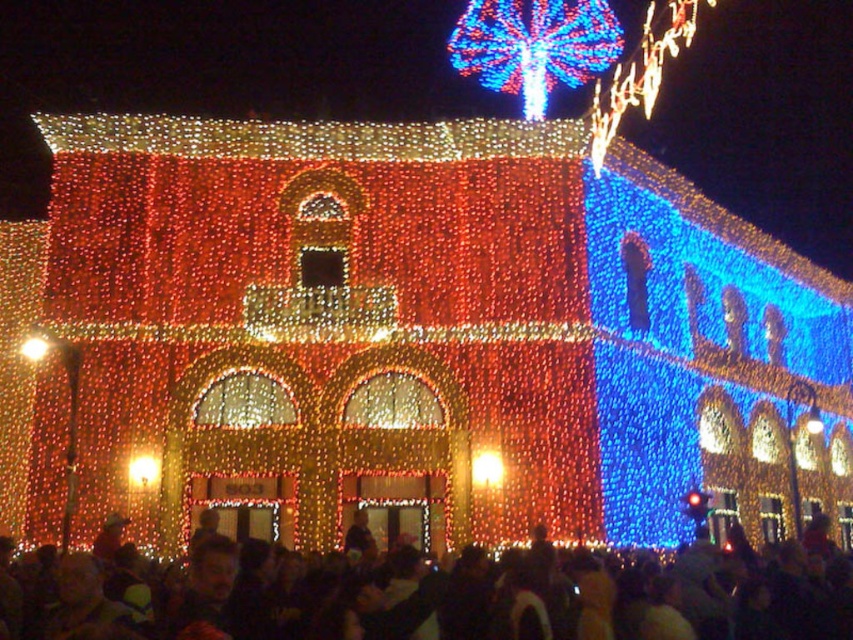
Locate an element on the screen. The width and height of the screenshot is (853, 640). matte gold light at center is located at coordinates [x=143, y=470].

Identify the location of matte gold light at center. (143, 470).

Is point (122, 561) more distant than point (134, 481)?

No, (122, 561) is in front of (134, 481).

Who is shorter, black matte crowd at lower center or matte gold light at center?

With less height is matte gold light at center.

Who is more distant from viewer, (775, 580) or (137, 472)?

Point (137, 472)

Find the location of `black matte crowd at lower center`. black matte crowd at lower center is located at coordinates (436, 595).

From the picture: Which is more to the right, black matte crowd at lower center or illuminated string lights at center?

black matte crowd at lower center is more to the right.

Which is in front, point (215, 556) or point (503, 468)?

Point (215, 556) is in front.

The height and width of the screenshot is (640, 853). Describe the element at coordinates (436, 595) in the screenshot. I see `black matte crowd at lower center` at that location.

The image size is (853, 640). What are the coordinates of `black matte crowd at lower center` in the screenshot? It's located at (436, 595).